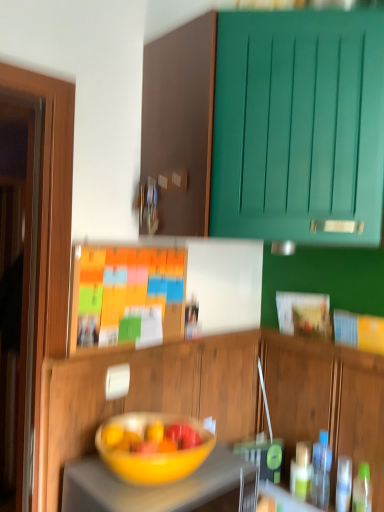
This screenshot has width=384, height=512. What do you see at coordinates (153, 454) in the screenshot? I see `matte yellow bowl at center` at bounding box center [153, 454].

Image resolution: width=384 pixels, height=512 pixels. Describe the element at coordinates (267, 123) in the screenshot. I see `teal wood cabinet at upper right, which ranks as the second cabinetry in bottom-to-top order` at that location.

Image resolution: width=384 pixels, height=512 pixels. Find the location of `transparent plastic bottle at right`. transparent plastic bottle at right is located at coordinates coord(321,471).

The height and width of the screenshot is (512, 384). What do you see at coordinates (321, 471) in the screenshot?
I see `transparent plastic bottle at right` at bounding box center [321, 471].

Identify the location of matte yellow bowl at center. The width and height of the screenshot is (384, 512). (153, 454).

In terms of width, does wooden cabinet at center, which is the 2th cabinetry in top-to-bottom order, look wider or thinner when compared to orange matte bulletin board at center?

In the image, wooden cabinet at center, which is the 2th cabinetry in top-to-bottom order, appears to be wider than orange matte bulletin board at center.

Is wooden cabinet at center, which is the 1th cabinetry from bottom to top, aimed at orange matte bulletin board at center?

No, wooden cabinet at center, which is the 1th cabinetry from bottom to top, is not aimed at orange matte bulletin board at center.

From the image's perspective, is wooden cabinet at center, which is the 1th cabinetry from bottom to top, below orange matte bulletin board at center?

Yes, from the image's perspective, wooden cabinet at center, which is the 1th cabinetry from bottom to top, is beneath orange matte bulletin board at center.

Is wooden cabinet at center, which is the 2th cabinetry in top-to-bottom order, positioned beyond the bounds of orange matte bulletin board at center?

Indeed, wooden cabinet at center, which is the 2th cabinetry in top-to-bottom order, is completely outside orange matte bulletin board at center.

In the image, is teal wood cabinet at upper right, which ranks as the second cabinetry in bottom-to-top order, on the left side or the right side of matte yellow bowl at center?

In the image, teal wood cabinet at upper right, which ranks as the second cabinetry in bottom-to-top order, appears on the right side of matte yellow bowl at center.

From a real-world perspective, which is physically above, teal wood cabinet at upper right, marked as the 1th cabinetry in a top-to-bottom arrangement, or matte yellow bowl at center?

teal wood cabinet at upper right, marked as the 1th cabinetry in a top-to-bottom arrangement, is physically above.

Considering the positions of objects teal wood cabinet at upper right, marked as the 1th cabinetry in a top-to-bottom arrangement, and matte yellow bowl at center in the image provided, who is in front, teal wood cabinet at upper right, marked as the 1th cabinetry in a top-to-bottom arrangement, or matte yellow bowl at center?

teal wood cabinet at upper right, marked as the 1th cabinetry in a top-to-bottom arrangement.

From the image's perspective, which object appears higher, teal wood cabinet at upper right, which ranks as the second cabinetry in bottom-to-top order, or matte yellow bowl at center?

From the image's view, teal wood cabinet at upper right, which ranks as the second cabinetry in bottom-to-top order, is above.

In terms of width, does yellow matte bowl at center look wider or thinner when compared to orange matte bulletin board at center?

Clearly, yellow matte bowl at center has more width compared to orange matte bulletin board at center.

Are yellow matte bowl at center and orange matte bulletin board at center located far from each other?

No.

Does point (239, 480) appear closer or farther from the camera than point (77, 282)?

Point (239, 480) is positioned closer to the camera compared to point (77, 282).

Looking at this image, which of these two, yellow matte bowl at center or orange matte bulletin board at center, is bigger?

With larger size is yellow matte bowl at center.

Based on the photo, from the image's perspective, is yellow matte bowl at center located above transparent plastic bottle at right?

Yes, from the image's perspective, yellow matte bowl at center is above transparent plastic bottle at right.

Is yellow matte bowl at center oriented away from transparent plastic bottle at right?

That's not correct — yellow matte bowl at center is not looking away from transparent plastic bottle at right.

Is point (314, 502) farther from viewer compared to point (256, 429)?

No.

Is transparent plastic bottle at right directly adjacent to wooden cabinet at center, which is the 2th cabinetry in top-to-bottom order?

No, transparent plastic bottle at right is not making contact with wooden cabinet at center, which is the 2th cabinetry in top-to-bottom order.

From a real-world perspective, is transparent plastic bottle at right located higher than wooden cabinet at center, which is the 1th cabinetry from bottom to top?

No.

Who is more distant, transparent plastic bottle at right or wooden cabinet at center, which is the 2th cabinetry in top-to-bottom order?

transparent plastic bottle at right is more distant.

Is teal wood cabinet at upper right, which ranks as the second cabinetry in bottom-to-top order, taller than transparent plastic bottle at right?

Indeed, teal wood cabinet at upper right, which ranks as the second cabinetry in bottom-to-top order, has a greater height compared to transparent plastic bottle at right.

Which is more to the left, teal wood cabinet at upper right, which ranks as the second cabinetry in bottom-to-top order, or transparent plastic bottle at right?

teal wood cabinet at upper right, which ranks as the second cabinetry in bottom-to-top order, is more to the left.

From the image's perspective, is teal wood cabinet at upper right, marked as the 1th cabinetry in a top-to-bottom arrangement, above or below transparent plastic bottle at right?

teal wood cabinet at upper right, marked as the 1th cabinetry in a top-to-bottom arrangement, is above transparent plastic bottle at right.

I want to click on bulletin board that appears on the left of wooden cabinet at center, which is the 1th cabinetry from bottom to top, so click(126, 295).

Which object is thinner, orange matte bulletin board at center or wooden cabinet at center, which is the 1th cabinetry from bottom to top?

With smaller width is orange matte bulletin board at center.

Is orange matte bulletin board at center placed right next to wooden cabinet at center, which is the 2th cabinetry in top-to-bottom order?

They are not placed beside each other.

This screenshot has width=384, height=512. What are the coordinates of `bulletin board above the wooden cabinet at center, which is the 2th cabinetry in top-to-bottom order (from the image's perspective)` in the screenshot? It's located at (126, 295).

Where is `cabinetry above the matte yellow bowl at center (from a real-world perspective)`? The image size is (384, 512). cabinetry above the matte yellow bowl at center (from a real-world perspective) is located at coordinates (267, 123).

Looking at the image, which one is located further to orange matte bulletin board at center, teal wood cabinet at upper right, which ranks as the second cabinetry in bottom-to-top order, or transparent plastic bottle at right?

Among the two, transparent plastic bottle at right is located further to orange matte bulletin board at center.

Considering their positions, is teal wood cabinet at upper right, marked as the 1th cabinetry in a top-to-bottom arrangement, positioned closer to orange matte bulletin board at center than matte yellow bowl at center?

matte yellow bowl at center.

From the image, which object appears to be farther from orange matte bulletin board at center, wooden cabinet at center, which is the 2th cabinetry in top-to-bottom order, or matte yellow bowl at center?

matte yellow bowl at center.

Estimate the real-world distances between objects in this image. Which object is further from transparent plastic bottle at right, orange matte bulletin board at center or wooden cabinet at center, which is the 1th cabinetry from bottom to top?

The object further to transparent plastic bottle at right is orange matte bulletin board at center.

Considering their positions, is yellow matte bowl at center positioned further to teal wood cabinet at upper right, which ranks as the second cabinetry in bottom-to-top order, than transparent plastic bottle at right?

transparent plastic bottle at right.

Considering their positions, is matte yellow bowl at center positioned closer to orange matte bulletin board at center than yellow matte bowl at center?

matte yellow bowl at center is positioned closer to the anchor orange matte bulletin board at center.

Estimate the real-world distances between objects in this image. Which object is further from teal wood cabinet at upper right, which ranks as the second cabinetry in bottom-to-top order, transparent plastic bottle at right or wooden cabinet at center, which is the 1th cabinetry from bottom to top?

The object further to teal wood cabinet at upper right, which ranks as the second cabinetry in bottom-to-top order, is transparent plastic bottle at right.

Based on the photo, looking at the image, which one is located further to wooden cabinet at center, which is the 1th cabinetry from bottom to top, transparent plastic bottle at right or yellow matte bowl at center?

transparent plastic bottle at right.

I want to click on bowl located between orange matte bulletin board at center and transparent plastic bottle at right in the left-right direction, so click(x=153, y=454).

At what (x,y) coordinates should I click in order to perform the action: click on desk between wooden cabinet at center, which is the 1th cabinetry from bottom to top, and transparent plastic bottle at right, in the horizontal direction. Please return your answer as a coordinate pair (x, y). This screenshot has width=384, height=512. Looking at the image, I should click on (164, 488).

I want to click on bulletin board between teal wood cabinet at upper right, marked as the 1th cabinetry in a top-to-bottom arrangement, and matte yellow bowl at center, in the vertical direction, so click(126, 295).

Identify the location of bulletin board between teal wood cabinet at upper right, marked as the 1th cabinetry in a top-to-bottom arrangement, and yellow matte bowl at center, in the vertical direction. Image resolution: width=384 pixels, height=512 pixels. (126, 295).